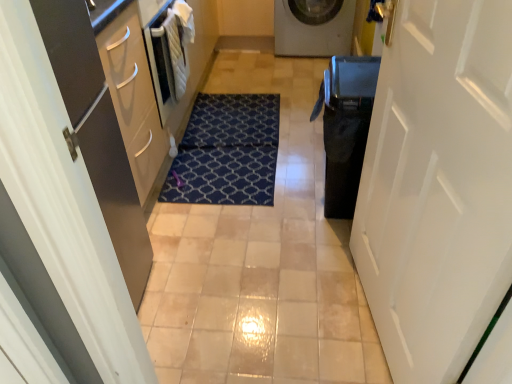
This screenshot has height=384, width=512. Find the location of `vacant space behind white matte door at right, which ranks as the second door in left-to-right order`. vacant space behind white matte door at right, which ranks as the second door in left-to-right order is located at coordinates (310, 244).